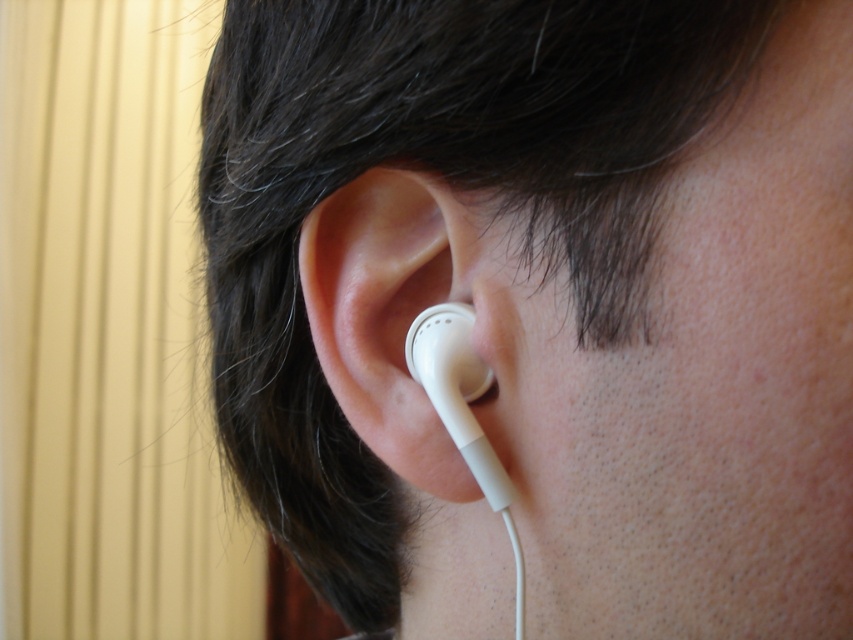
Is white matte earbud at center in front of white matte earbud at ear?

Yes, it is.

Does point (456, 260) lie in front of point (477, 452)?

No.

The height and width of the screenshot is (640, 853). I want to click on white matte earbud at center, so click(397, 310).